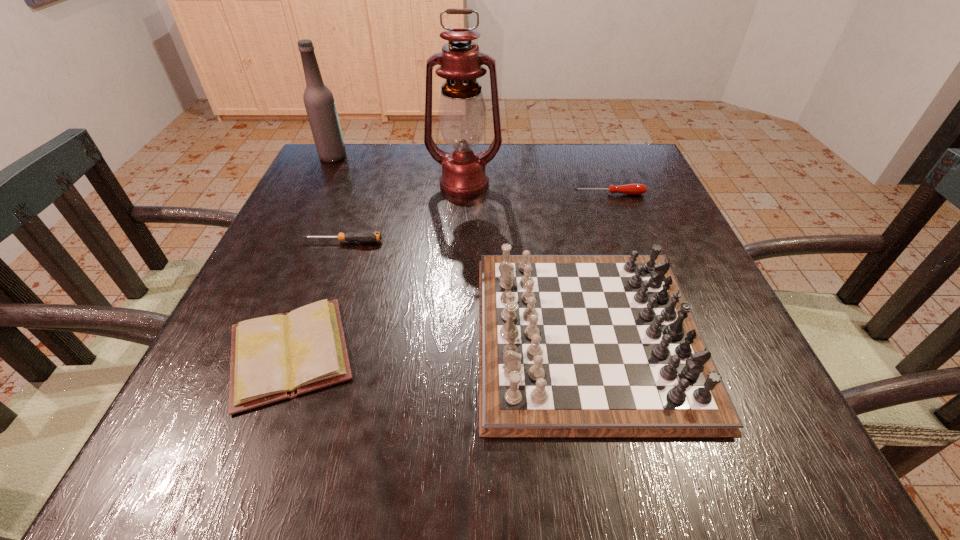
I want to click on free space located 0.060m from the player's perspective of the chessboard, so click(444, 334).

The width and height of the screenshot is (960, 540). I want to click on free space located 0.350m from the player's perspective of the chessboard, so click(275, 334).

Find the location of a particular element. Image resolution: width=960 pixels, height=540 pixels. vacant region located 0.180m from the player's perspective of the chessboard is located at coordinates (374, 334).

I want to click on free spot located on the left of the farther screwdriver, so click(x=502, y=194).

Locate an element on the screen. This screenshot has height=540, width=960. free space located 0.370m on the back of the left screwdriver is located at coordinates (374, 153).

Find the location of `free location located on the right of the diary`. free location located on the right of the diary is located at coordinates (499, 353).

You are a GUI agent. You are given a task and a screenshot of the screen. Output one action in this format:
    pyautogui.click(x=<x>, y=<y>)
    Task: Click on the oil lamp at the far edge
    
    Given the screenshot: What is the action you would take?
    pyautogui.click(x=462, y=114)

Where is `beer bottle present at the far edge`? This screenshot has height=540, width=960. beer bottle present at the far edge is located at coordinates (319, 102).

Locate an element on the screen. screwdriver located in the far edge section of the desktop is located at coordinates (632, 189).

You are a GUI agent. You are given a task and a screenshot of the screen. Output one action in this format:
    pyautogui.click(x=<x>, y=<y>)
    Task: Click on the chessboard located in the near edge section of the desktop
    The width and height of the screenshot is (960, 540).
    Given the screenshot: What is the action you would take?
    pyautogui.click(x=569, y=345)